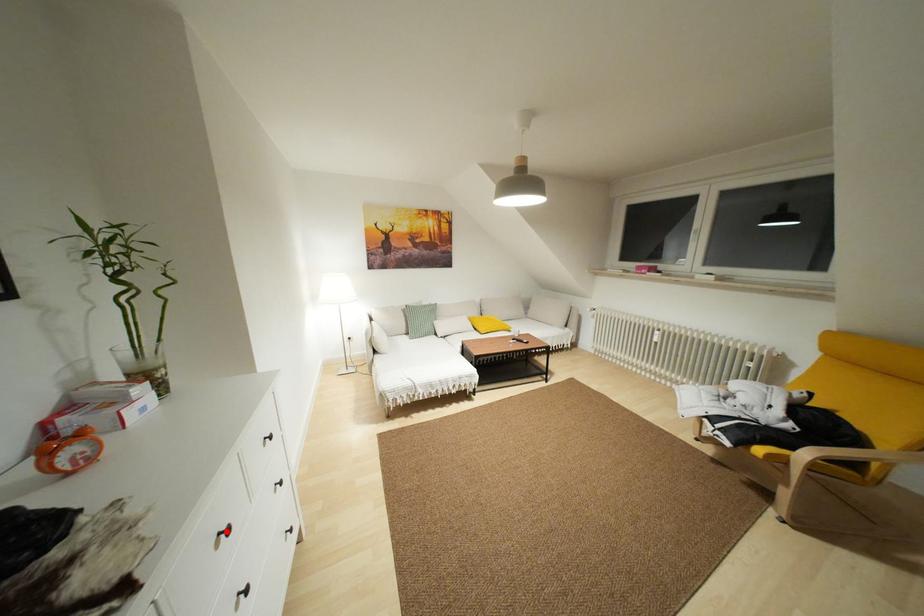
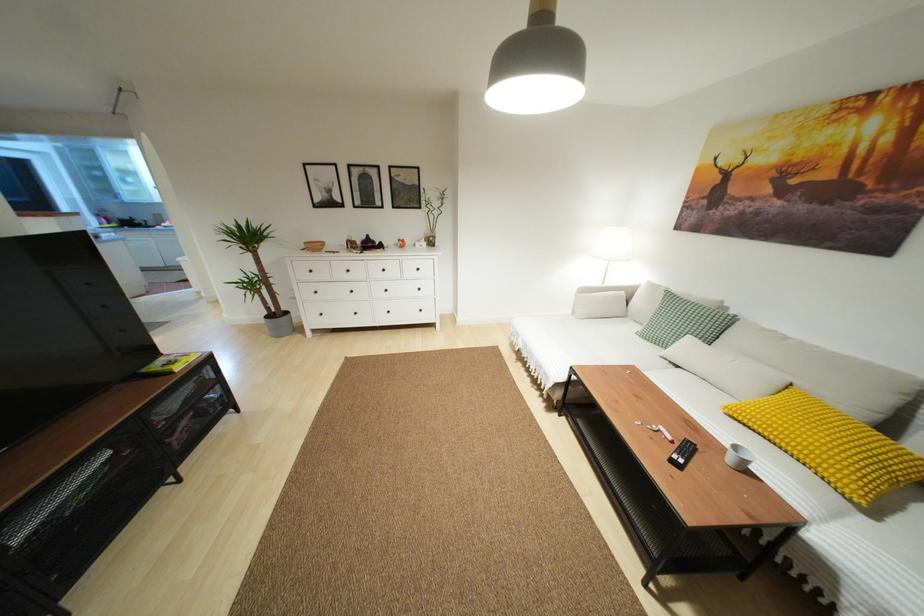
Find the pixel in the second image that matches the highlighted location in the first image.

(383, 270)